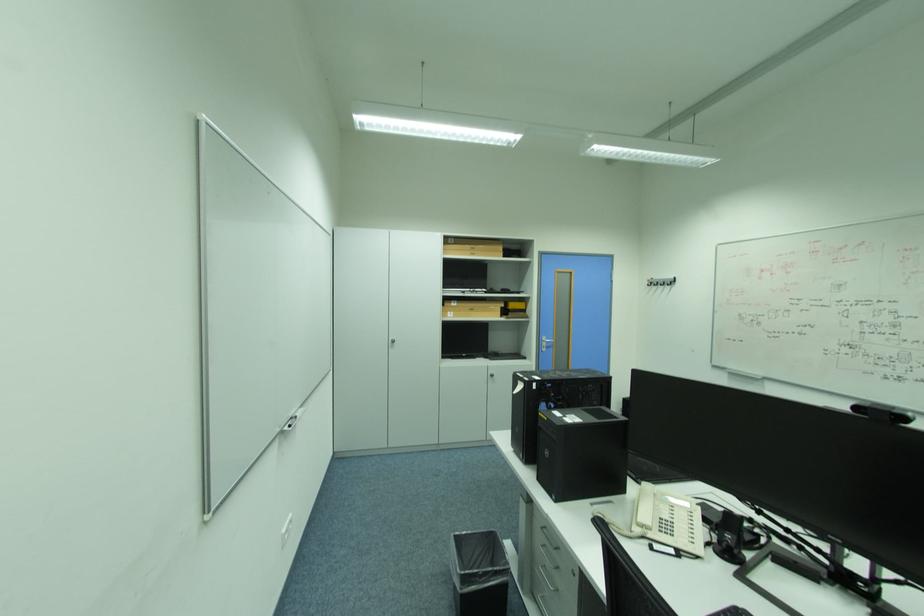
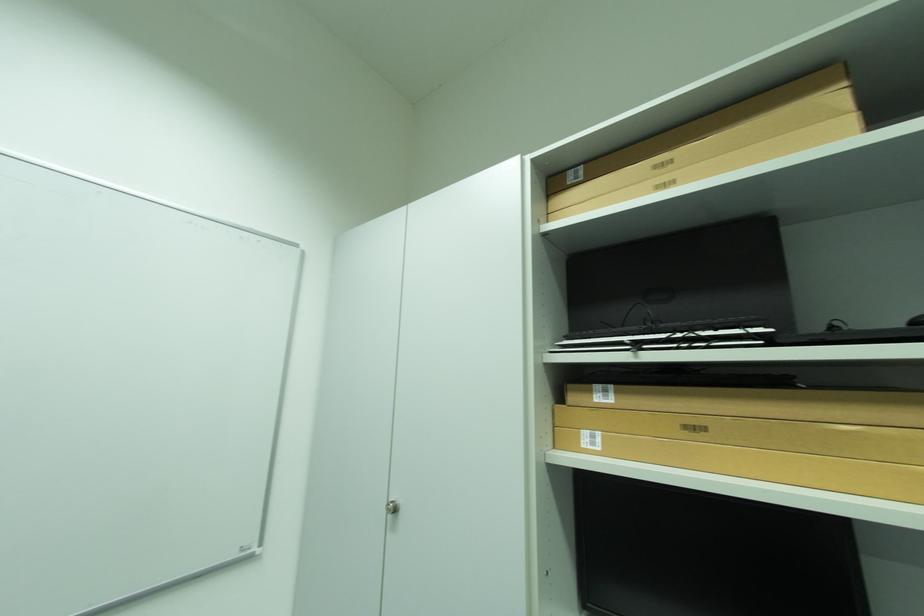
Where in the second image is the point corresponding to (x=456, y=313) from the first image?

(593, 434)